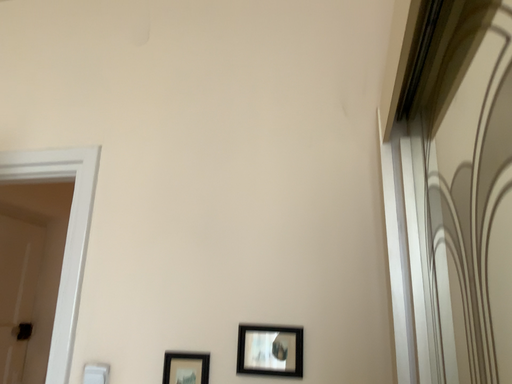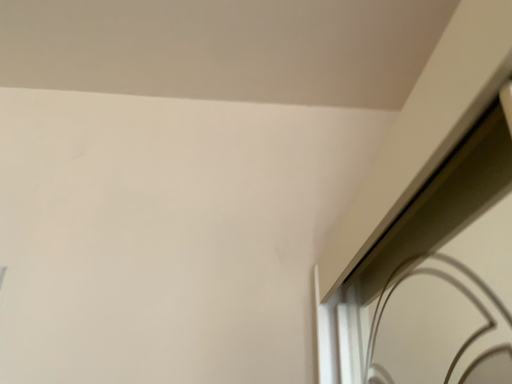
Question: Which way did the camera rotate in the video?

Choices:
 (A) rotated upward
 (B) rotated downward

Answer: (A)